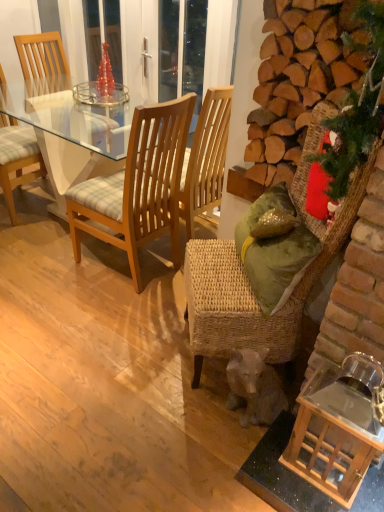
At what (x,y) coordinates should I click in order to perform the action: click on free space in front of woodenchair at left, positioned as the 3th chair in left-to-right order. Please return your answer as a coordinate pair (x, y). The height and width of the screenshot is (512, 384). Looking at the image, I should click on (107, 322).